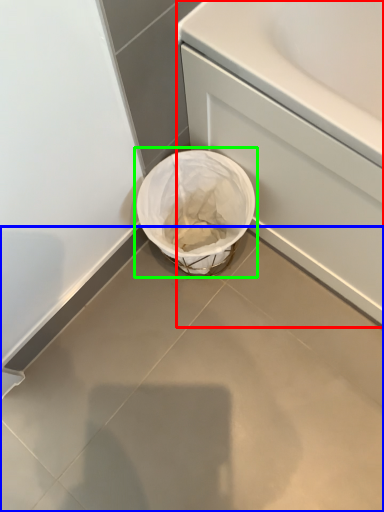
Question: Estimate the real-world distances between objects in this image. Which object is closer to bath (highlighted by a red box), concrete (highlighted by a blue box) or waste container (highlighted by a green box)?

Choices:
 (A) concrete
 (B) waste container

Answer: (B)